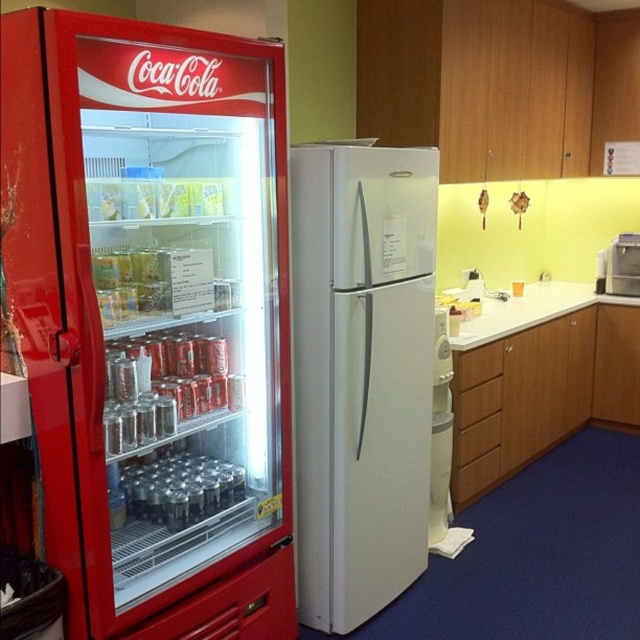
Question: Which of the following is the farthest from the observer?

Choices:
 (A) metallic silver coffee machine at upper right
 (B) white matte refrigerator at center
 (C) metallic red vending machine at left

Answer: (A)

Question: From the image, what is the correct spatial relationship of white laminate countertop at center in relation to metallic silver coffee machine at upper right?

Choices:
 (A) below
 (B) above

Answer: (A)

Question: Is white laminate countertop at center to the right of metallic silver coffee machine at upper right from the viewer's perspective?

Choices:
 (A) yes
 (B) no

Answer: (B)

Question: Does metallic red vending machine at left have a larger size compared to white laminate countertop at center?

Choices:
 (A) no
 (B) yes

Answer: (B)

Question: Which object is the closest to the white matte refrigerator at center?

Choices:
 (A) metallic silver coffee machine at upper right
 (B) white laminate countertop at center

Answer: (B)

Question: Considering the real-world distances, which object is closest to the metallic silver coffee machine at upper right?

Choices:
 (A) metallic red vending machine at left
 (B) white matte refrigerator at center
 (C) white laminate countertop at center

Answer: (C)